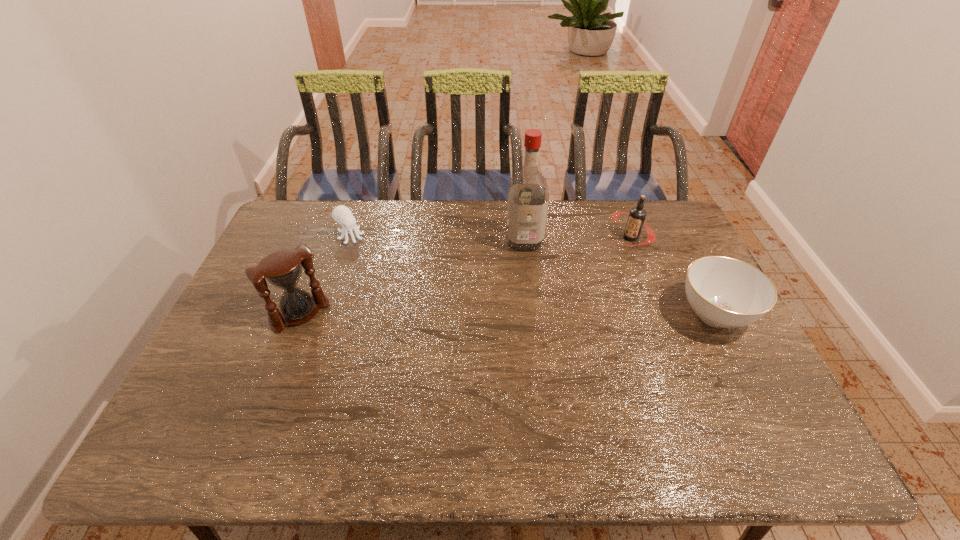
Find the location of a particular element. The height and width of the screenshot is (540, 960). unoccupied position between the root beer and the third object from left to right is located at coordinates (577, 239).

Identify the location of free point between the third shortest object and the octopus. (491, 237).

This screenshot has width=960, height=540. What are the coordinates of `vacant point located between the hourglass and the tallest object` in the screenshot? It's located at (413, 277).

This screenshot has height=540, width=960. I want to click on vacant region between the third shortest object and the chinaware, so click(x=672, y=275).

At what (x,y) coordinates should I click in order to perform the action: click on free spot between the octopus and the root beer. Please return your answer as a coordinate pair (x, y). Looking at the image, I should click on (491, 237).

Locate an element on the screen. unoccupied position between the third object from right to left and the octopus is located at coordinates (437, 239).

At what (x,y) coordinates should I click in order to perform the action: click on unoccupied area between the hourglass and the octopus. Please return your answer as a coordinate pair (x, y). The width and height of the screenshot is (960, 540). Looking at the image, I should click on (325, 275).

This screenshot has height=540, width=960. In order to click on free area in between the third object from right to left and the octopus in this screenshot , I will do `click(437, 239)`.

Select which object is the closest to the octopus. Please provide its 2D coordinates. Your answer should be formatted as a tuple, i.e. [(x, y)], where the tuple contains the x and y coordinates of a point satisfying the conditions above.

[(283, 269)]

What are the coordinates of `object that can be found as the fourth closest to the second tallest object` in the screenshot? It's located at (724, 292).